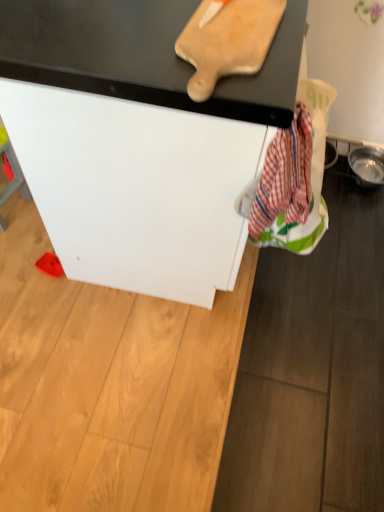
This screenshot has width=384, height=512. In order to click on empty space that is ontop of wooden cutting board at upper center (from a real-world perspective) in this screenshot , I will do `click(227, 28)`.